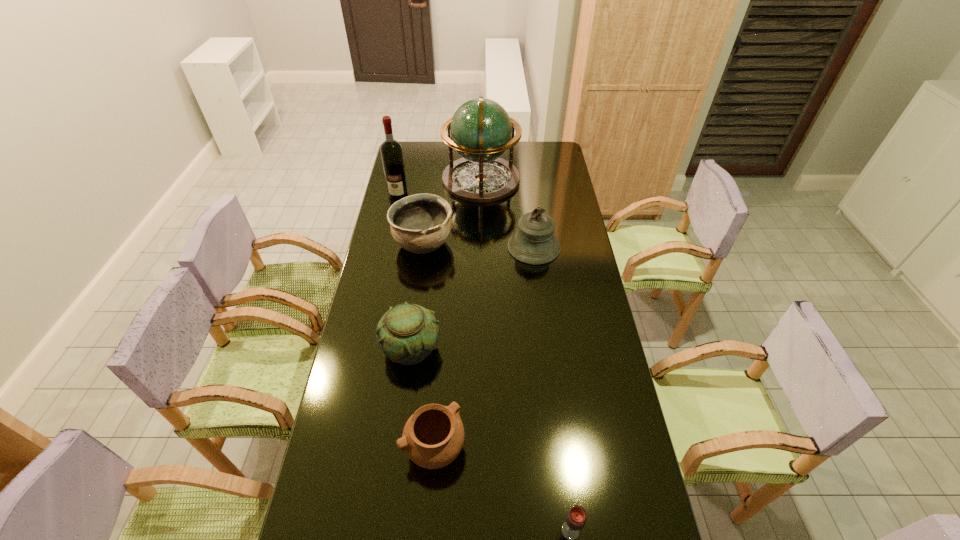
At what (x,y) coordinates should I click in order to perform the action: click on vacant space situated on the front and back of the alcohol. Please return your answer as a coordinate pair (x, y). The image size is (960, 540). Looking at the image, I should click on (389, 238).

You are a GUI agent. You are given a task and a screenshot of the screen. Output one action in this format:
    pyautogui.click(x=<x>, y=<y>)
    Task: Click on the vacant region located on the front of the fifth shortest object
    This screenshot has height=540, width=960.
    Given the screenshot: What is the action you would take?
    pyautogui.click(x=543, y=318)

Identify the location of vacant space positioned 0.130m on the front of the farthest pottery. (418, 288).

You are a GUI agent. You are given a task and a screenshot of the screen. Output one action in this format:
    pyautogui.click(x=<x>, y=<y>)
    Task: Click on the free space located on the front of the second nearest pottery
    This screenshot has height=540, width=960.
    Given the screenshot: What is the action you would take?
    [396, 460]

At what (x,y) coordinates should I click in order to perform the action: click on free space located 0.210m on the back of the second nearest object. Please return your answer as a coordinate pair (x, y). The width and height of the screenshot is (960, 540). Looking at the image, I should click on (441, 360).

This screenshot has width=960, height=540. What are the coordinates of `object that is at the far edge` in the screenshot? It's located at (481, 130).

Find the location of a particular element. The height and width of the screenshot is (540, 960). alcohol that is at the left edge is located at coordinates (391, 151).

You are a GUI agent. You are given a task and a screenshot of the screen. Output one action in this format:
    pyautogui.click(x=<x>, y=<y>)
    Task: Click on the object that is at the right edge
    The width and height of the screenshot is (960, 540).
    Given the screenshot: What is the action you would take?
    pyautogui.click(x=534, y=243)

In the image, there is a desktop. At what (x,y) coordinates should I click in order to perform the action: click on free space at the left edge. Please return your answer as a coordinate pair (x, y). Looking at the image, I should click on (410, 255).

Where is `free spot at the right edge of the desktop`? This screenshot has width=960, height=540. free spot at the right edge of the desktop is located at coordinates (590, 389).